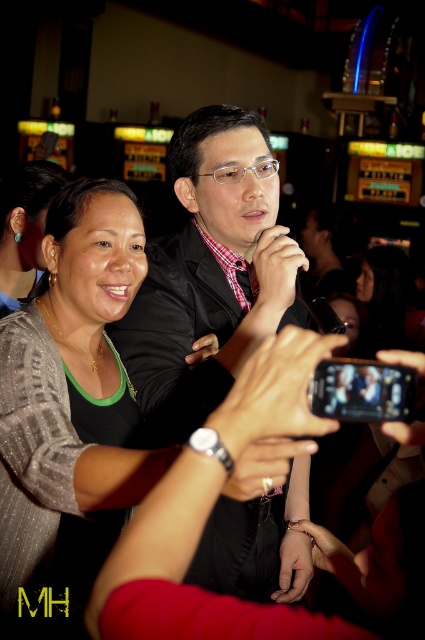
Which is below, sparkly silver blouse at center or turquoise gemstone earring at left?

sparkly silver blouse at center is lower down.

Between sparkly silver blouse at center and turquoise gemstone earring at left, which one is positioned higher?

turquoise gemstone earring at left

Which is behind, point (65, 566) or point (11, 304)?

Point (11, 304)

Image resolution: width=425 pixels, height=640 pixels. Identify the location of sparkly silver blouse at center. (70, 404).